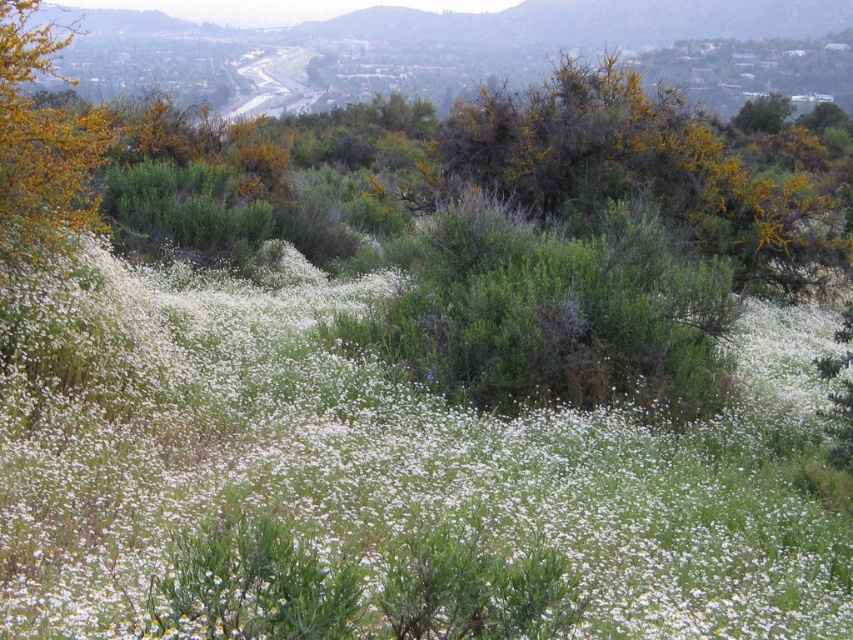
Question: Based on their relative distances, which object is nearer to the green leafy bush at upper right?

Choices:
 (A) golden textured bush at upper left
 (B) white soft petals at center

Answer: (A)

Question: Is white soft petals at center to the left of golden textured bush at upper left from the viewer's perspective?

Choices:
 (A) yes
 (B) no

Answer: (B)

Question: Can you confirm if golden textured bush at upper left is positioned above green leafy bush at upper right?

Choices:
 (A) no
 (B) yes

Answer: (A)

Question: Which point appears closest to the camera in this image?

Choices:
 (A) (776, 115)
 (B) (3, 67)

Answer: (B)

Question: Estimate the real-world distances between objects in this image. Which object is farther from the white soft petals at center?

Choices:
 (A) golden textured bush at upper left
 (B) green leafy bush at upper right

Answer: (B)

Question: Is golden textured bush at upper left above green leafy bush at upper right?

Choices:
 (A) yes
 (B) no

Answer: (B)